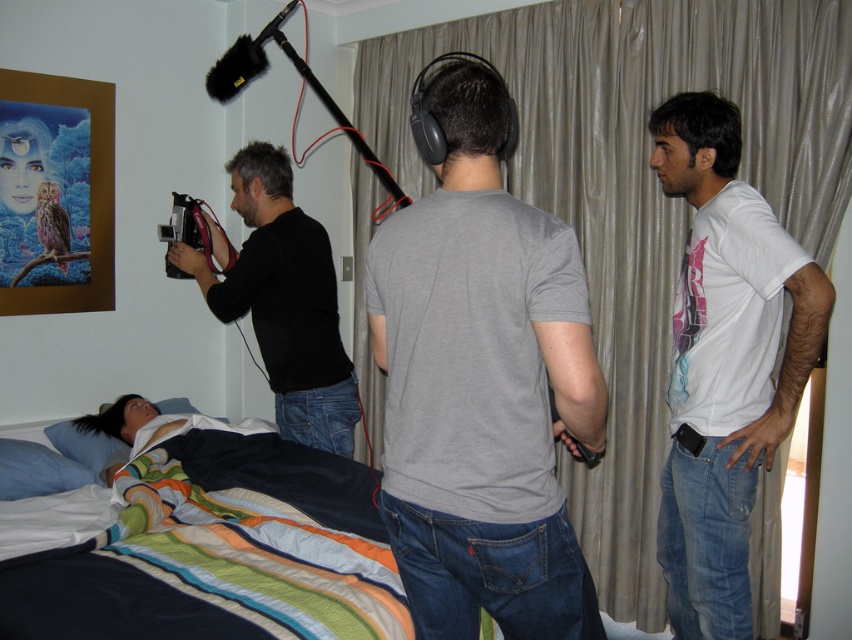
What is located at the point with coordinates (482, 387)?

The point with coordinates 0.605, 0567 marks the gray cotton t shirt at center.